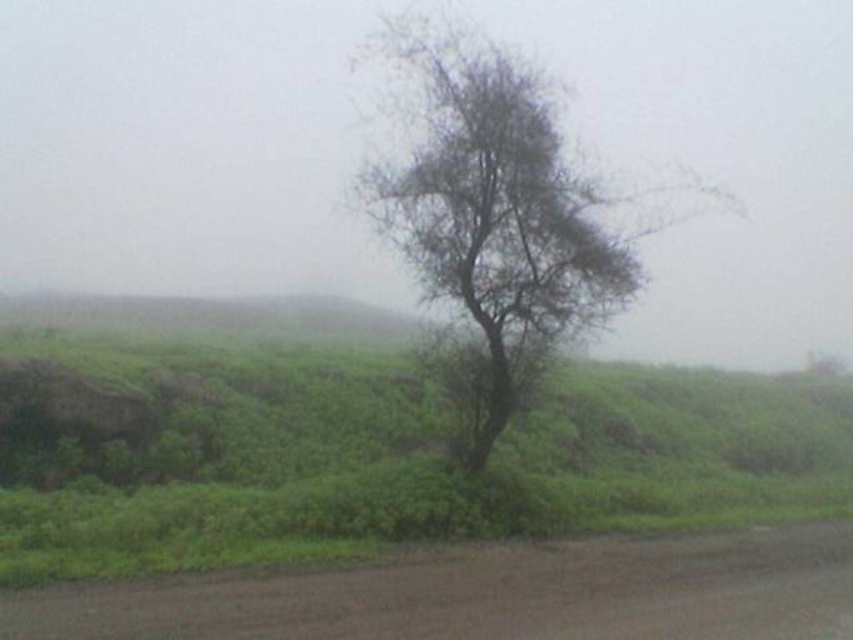
Question: Which of the following is the closest to the observer?

Choices:
 (A) green leafy tree at center
 (B) brown dirt track at lower center

Answer: (B)

Question: Can you confirm if green leafy tree at center is positioned to the left of brown dirt track at lower center?

Choices:
 (A) yes
 (B) no

Answer: (B)

Question: Does green leafy tree at center have a lesser width compared to brown dirt track at lower center?

Choices:
 (A) no
 (B) yes

Answer: (A)

Question: Which point is closer to the camera taking this photo?

Choices:
 (A) (408, 172)
 (B) (418, 573)

Answer: (B)

Question: Is green leafy tree at center closer to the viewer compared to brown dirt track at lower center?

Choices:
 (A) yes
 (B) no

Answer: (B)

Question: Which point is farther to the camera?

Choices:
 (A) brown dirt track at lower center
 (B) green leafy tree at center

Answer: (B)